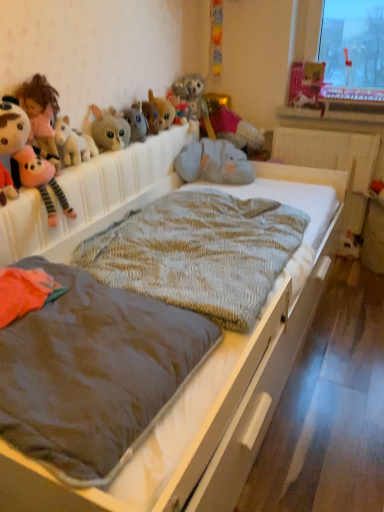
This screenshot has height=512, width=384. Find the location of `empty space that is ontop of white textured radiator at center (from a real-world perspective)`. empty space that is ontop of white textured radiator at center (from a real-world perspective) is located at coordinates (308, 128).